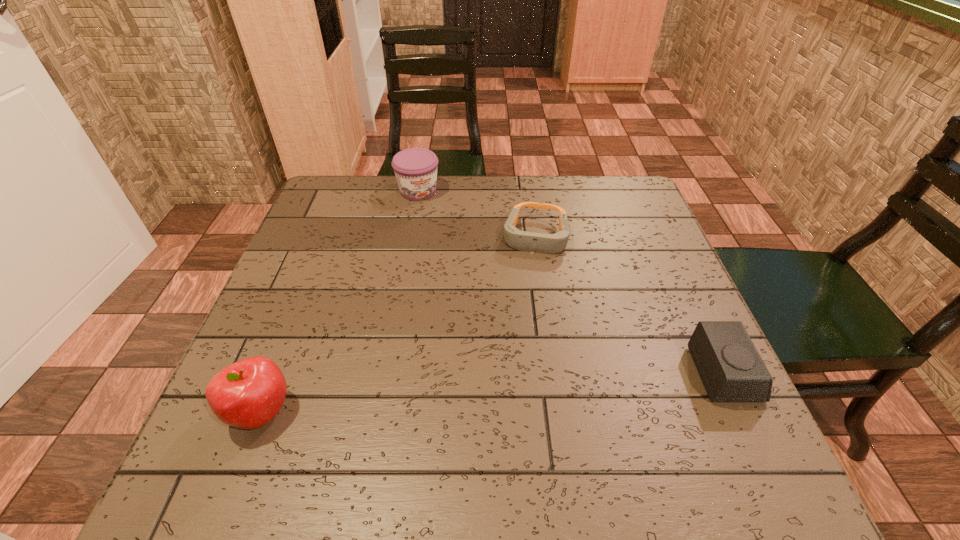
Find the location of a particular element. The height and width of the screenshot is (540, 960). the second closest object to the leftmost object is located at coordinates (415, 169).

Locate an element on the screen. vacant space that satisfies the following two spatial constraints: 1. on the back side of the second shortest object; 2. on the front-facing side of the leftmost object is located at coordinates (276, 374).

In order to click on vacant space that satisfies the following two spatial constraints: 1. on the front side of the alarm clock; 2. on the front-facing side of the shortest object in this screenshot , I will do [554, 374].

Identify the location of vacant space that satisfies the following two spatial constraints: 1. on the front side of the third object from left to right; 2. on the front-facing side of the third tallest object. (554, 374).